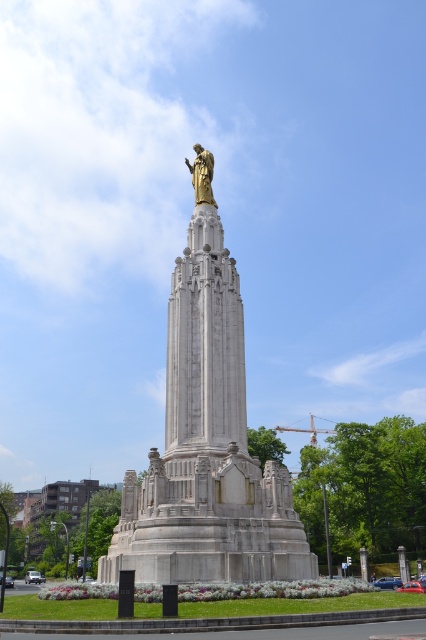
Is point (224, 321) positioned in front of point (213, 198)?

Yes, it is in front of point (213, 198).

From the picture: Can you confirm if polished bronze statue at center is positioned to the right of gold polished statue at upper center?

Yes, polished bronze statue at center is to the right of gold polished statue at upper center.

The width and height of the screenshot is (426, 640). I want to click on polished bronze statue at center, so click(x=207, y=448).